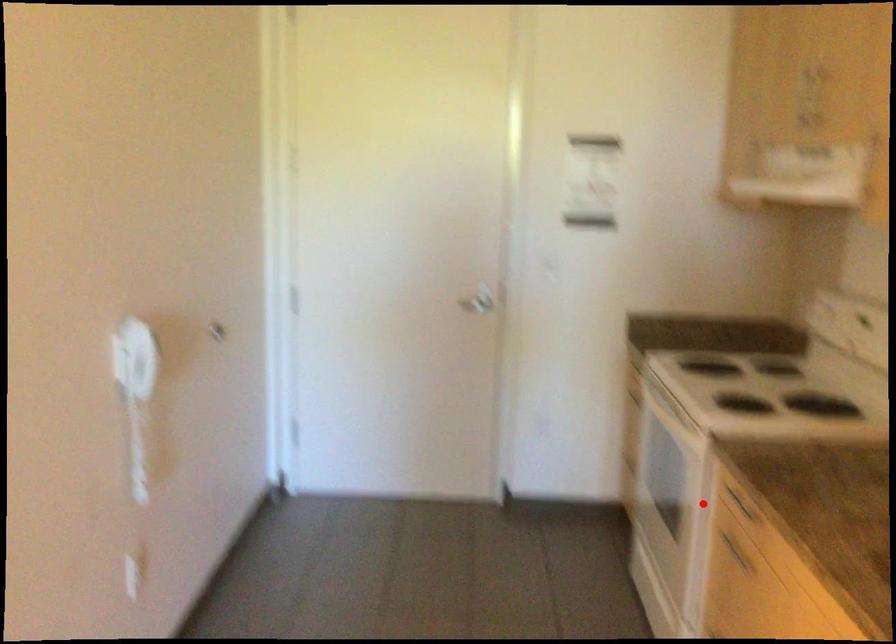
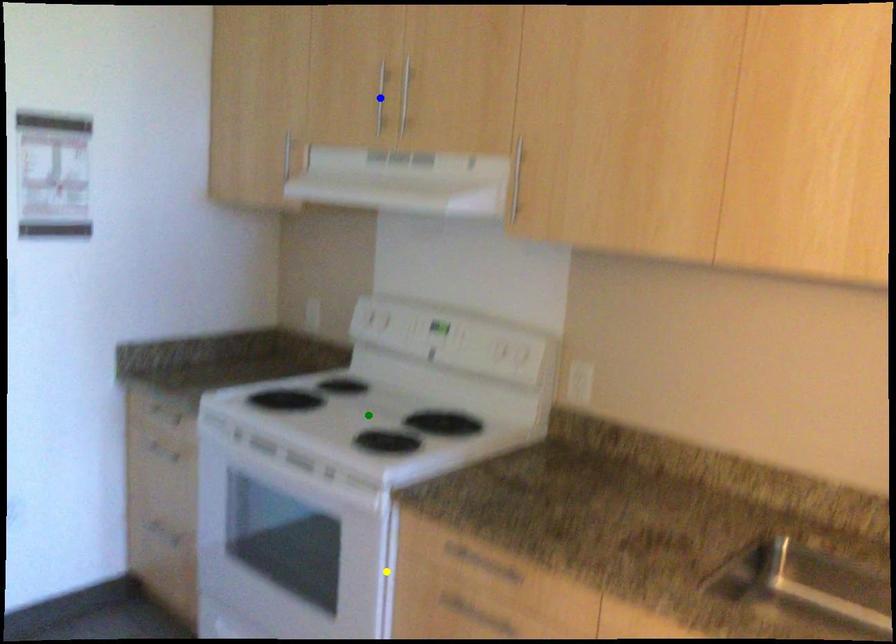
Question: I am providing you with two images of the same scene from different viewpoints. A red point is marked on the first image. You are given multiple points on the second image. In image 2, which mark is for the same physical point as the one in image 1?

Choices:
 (A) blue point
 (B) yellow point
 (C) green point

Answer: (B)